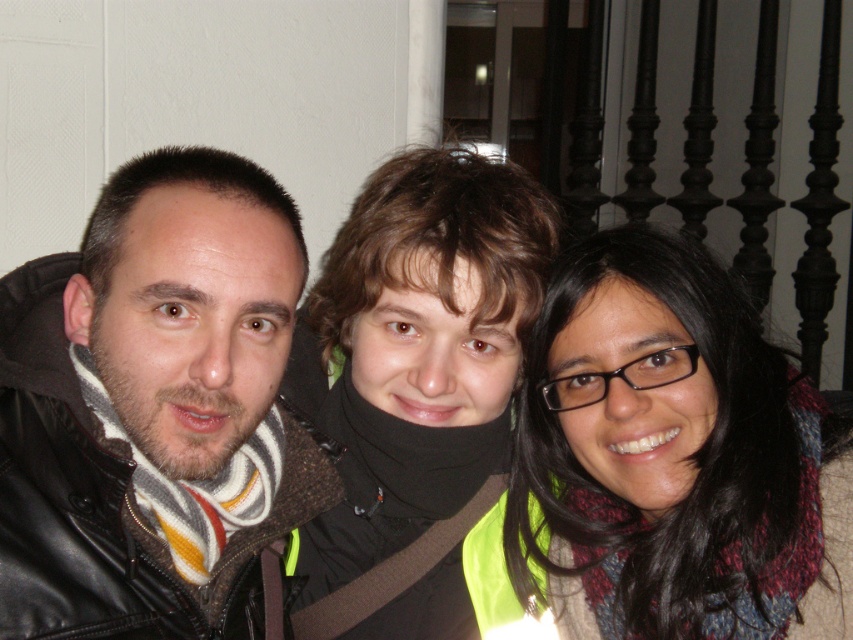
Between leather jacket at left and black matte scarf at center, which one appears on the right side from the viewer's perspective?

black matte scarf at center is more to the right.

Does leather jacket at left appear over black matte scarf at center?

Yes.

Is point (238, 444) behind point (532, 256)?

No.

At what (x,y) coordinates should I click in order to perform the action: click on leather jacket at left. Please return your answer as a coordinate pair (x, y). This screenshot has height=640, width=853. Looking at the image, I should click on (154, 410).

Who is positioned more to the left, leather jacket at left or multicolored scarf at right?

Positioned to the left is leather jacket at left.

Who is positioned more to the right, leather jacket at left or multicolored scarf at right?

From the viewer's perspective, multicolored scarf at right appears more on the right side.

Does point (294, 448) lie in front of point (791, 493)?

No, (294, 448) is further to viewer.

Locate an element on the screen. This screenshot has height=640, width=853. leather jacket at left is located at coordinates (154, 410).

From the picture: Is multicolored scarf at right smaller than black matte scarf at center?

Yes, multicolored scarf at right is smaller than black matte scarf at center.

Looking at this image, is multicolored scarf at right to the right of black matte scarf at center from the viewer's perspective?

Yes, multicolored scarf at right is to the right of black matte scarf at center.

The height and width of the screenshot is (640, 853). What do you see at coordinates (666, 464) in the screenshot?
I see `multicolored scarf at right` at bounding box center [666, 464].

Find the location of `multicolored scarf at right`. multicolored scarf at right is located at coordinates (666, 464).